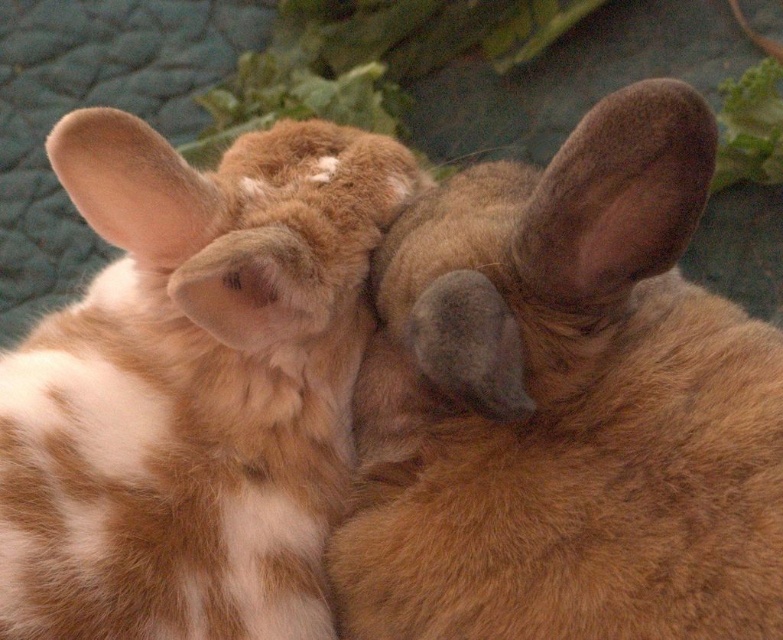
Question: Which point is farther to the camera?

Choices:
 (A) gray soft fur ear at center
 (B) fuzzy brown ear at center
 (C) brown furry ear at upper right

Answer: (B)

Question: Is brown furry ear at upper right thinner than fuzzy brown ear at upper left?

Choices:
 (A) yes
 (B) no

Answer: (A)

Question: Which point is closer to the camera?

Choices:
 (A) brown furry ear at upper right
 (B) fluffy brown rabbit at center
 (C) brown furry rabbit at center

Answer: (A)

Question: Is fuzzy brown ear at upper left to the left of fuzzy brown ear at center from the viewer's perspective?

Choices:
 (A) yes
 (B) no

Answer: (A)

Question: Can you confirm if brown furry ear at upper right is bigger than fuzzy brown ear at center?

Choices:
 (A) yes
 (B) no

Answer: (A)

Question: Which point is closer to the camera?

Choices:
 (A) fuzzy brown ear at center
 (B) fluffy brown rabbit at center

Answer: (B)